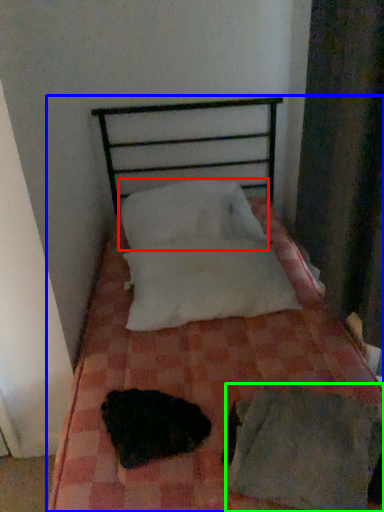
Question: Estimate the real-world distances between objects in this image. Which object is farther from pillow (highlighted by a red box), bed (highlighted by a blue box) or sheet (highlighted by a green box)?

Choices:
 (A) bed
 (B) sheet

Answer: (B)